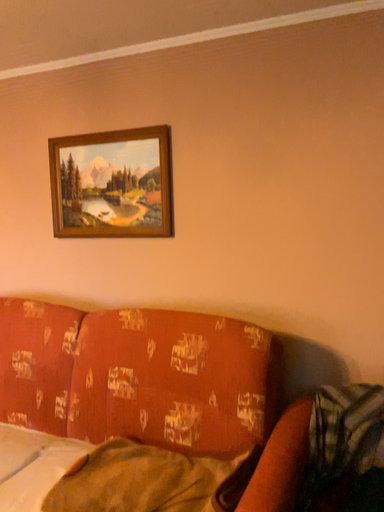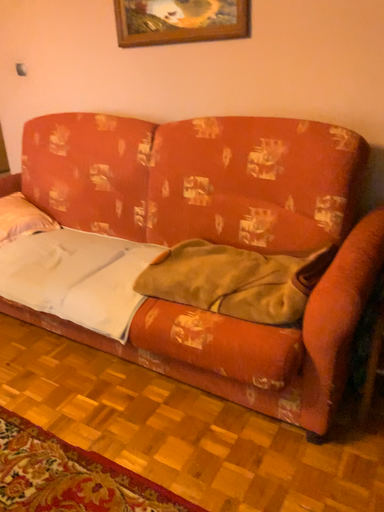
Question: How did the camera likely rotate when shooting the video?

Choices:
 (A) rotated right
 (B) rotated left

Answer: (B)